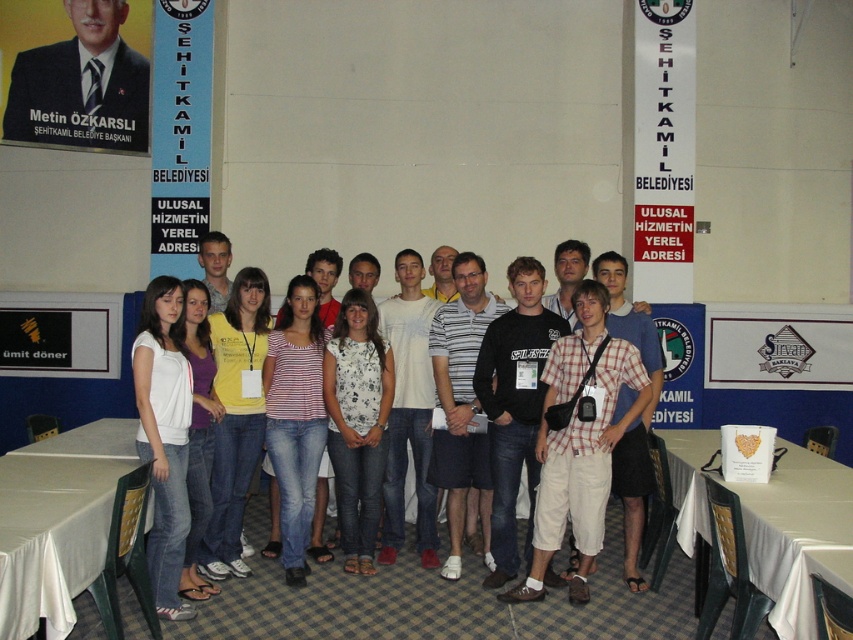
Can you confirm if jeans at center is wider than white fabric table at lower right?

No, jeans at center is not wider than white fabric table at lower right.

Does point (189, 332) come in front of point (804, 579)?

No, (189, 332) is further to viewer.

Between point (195, 484) and point (798, 628), which one is positioned in front?

Point (798, 628)

This screenshot has width=853, height=640. Find the location of `jeans at center`. jeans at center is located at coordinates click(x=410, y=336).

Is white fabric table at lower right further to camera compared to white cotton shirt at center?

No, it is not.

Is white fabric table at lower right above white cotton shirt at center?

No, white fabric table at lower right is not above white cotton shirt at center.

Between point (816, 476) and point (154, 561), which one is positioned behind?

Positioned behind is point (816, 476).

Identify the location of white fabric table at lower right. The image size is (853, 640). (773, 522).

Can you confirm if jeans at center is thinner than white cotton shirt at center?

No, jeans at center is not thinner than white cotton shirt at center.

Does jeans at center appear on the left side of white cotton shirt at center?

Incorrect, jeans at center is not on the left side of white cotton shirt at center.

Where is `jeans at center`? jeans at center is located at coordinates (410, 336).

Where is `jeans at center`? The image size is (853, 640). jeans at center is located at coordinates (410, 336).